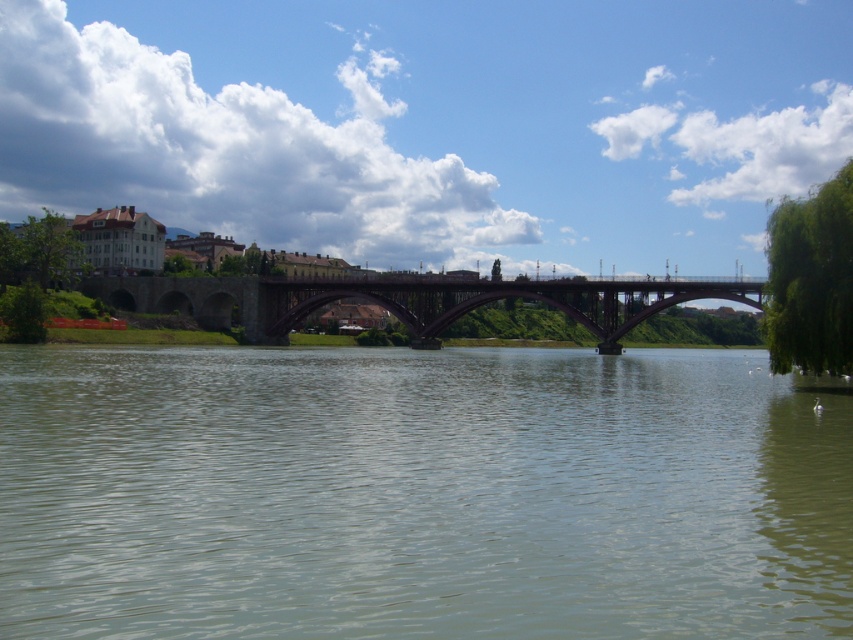
You are a tourist standing on the left bank of the river and want to take a photo of the dark brown stone bridge at center and the greenish water at center. Which object should you frame first in your camera to ensure both are in the shot?

You should frame the dark brown stone bridge at center first because the greenish water at center is to the right of it, so positioning the bridge first will allow the water to naturally come into the frame on its right side.

You are a boat captain trying to navigate a narrow boat through the river. The boat requires a passage width of 5 meters to pass safely. Based on the scene, can you determine if the greenish water at center has enough width compared to the dark brown stone bridge at center to allow your boat to pass?

The greenish water at center has a width less than the dark brown stone bridge at center, so it may not provide enough space for the boat requiring 5 meters. Check the bridge width first to confirm.